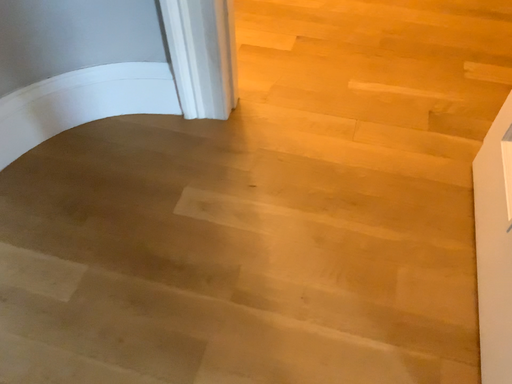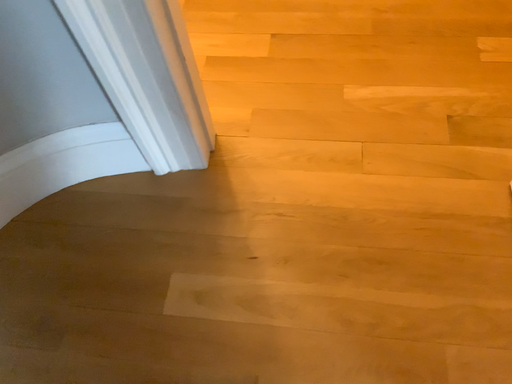
Question: How did the camera likely rotate when shooting the video?

Choices:
 (A) rotated upward
 (B) rotated downward

Answer: (B)